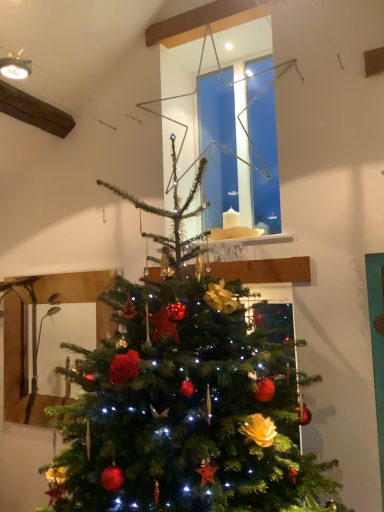
Question: Are green matte christmas tree at center and metallic wire star at upper center beside each other?

Choices:
 (A) yes
 (B) no

Answer: (B)

Question: Is green matte christmas tree at center shorter than metallic wire star at upper center?

Choices:
 (A) yes
 (B) no

Answer: (B)

Question: Is green matte christmas tree at center completely or partially outside of metallic wire star at upper center?

Choices:
 (A) yes
 (B) no

Answer: (A)

Question: Is metallic wire star at upper center a part of green matte christmas tree at center?

Choices:
 (A) no
 (B) yes

Answer: (A)

Question: From a real-world perspective, is green matte christmas tree at center over metallic wire star at upper center?

Choices:
 (A) yes
 (B) no

Answer: (B)

Question: From the image's perspective, is green matte christmas tree at center below metallic wire star at upper center?

Choices:
 (A) yes
 (B) no

Answer: (A)

Question: Is metallic wire star at upper center taller than green matte christmas tree at center?

Choices:
 (A) yes
 (B) no

Answer: (B)

Question: Is metallic wire star at upper center placed right next to green matte christmas tree at center?

Choices:
 (A) no
 (B) yes

Answer: (A)

Question: From the image's perspective, is metallic wire star at upper center beneath green matte christmas tree at center?

Choices:
 (A) no
 (B) yes

Answer: (A)

Question: From a real-world perspective, does metallic wire star at upper center stand above green matte christmas tree at center?

Choices:
 (A) yes
 (B) no

Answer: (A)

Question: Does metallic wire star at upper center appear on the right side of green matte christmas tree at center?

Choices:
 (A) no
 (B) yes

Answer: (B)

Question: From a real-world perspective, does metallic wire star at upper center sit lower than green matte christmas tree at center?

Choices:
 (A) yes
 (B) no

Answer: (B)

Question: Would you say metallic wire star at upper center is inside or outside green matte christmas tree at center?

Choices:
 (A) inside
 (B) outside

Answer: (B)